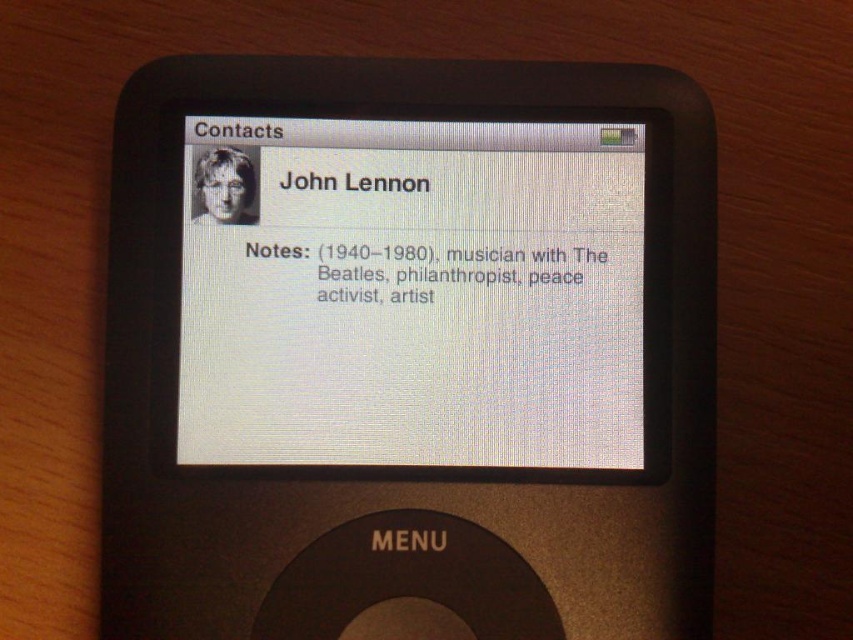
Question: Which point appears closest to the camera in this image?

Choices:
 (A) (158, 276)
 (B) (508, 268)
 (C) (427, 260)
 (D) (537, 205)

Answer: (A)

Question: Which point appears closest to the camera in this image?

Choices:
 (A) (422, 397)
 (B) (505, 256)
 (C) (469, 250)
 (D) (642, 260)

Answer: (A)

Question: Does black matte text at center appear on the right side of white matte text at center?

Choices:
 (A) no
 (B) yes

Answer: (B)

Question: Does white matte screen at center have a smaller size compared to white matte text at center?

Choices:
 (A) yes
 (B) no

Answer: (B)

Question: Does white matte screen at center appear on the right side of white matte text at center?

Choices:
 (A) yes
 (B) no

Answer: (B)

Question: Which of these objects is positioned closest to the white matte screen at center?

Choices:
 (A) black matte text at center
 (B) white matte text at center
 (C) black plastic ipod at center

Answer: (C)